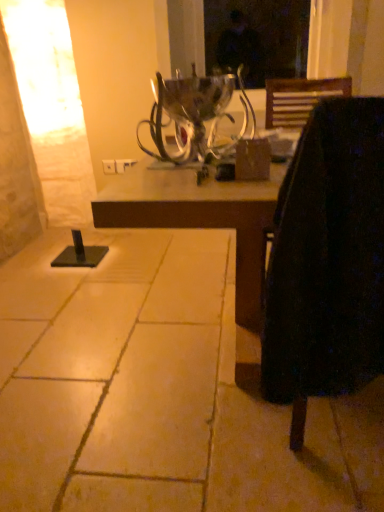
Question: From the image's perspective, is black fabric chair at right on top of metallic silver candle holder at center?

Choices:
 (A) no
 (B) yes

Answer: (A)

Question: Is black fabric chair at right directly adjacent to metallic silver candle holder at center?

Choices:
 (A) no
 (B) yes

Answer: (A)

Question: From a real-world perspective, is black fabric chair at right below metallic silver candle holder at center?

Choices:
 (A) no
 (B) yes

Answer: (B)

Question: Is black fabric chair at right wider than metallic silver candle holder at center?

Choices:
 (A) yes
 (B) no

Answer: (A)

Question: Can you confirm if black fabric chair at right is thinner than metallic silver candle holder at center?

Choices:
 (A) no
 (B) yes

Answer: (A)

Question: In terms of width, does brown tile floor at lower left look wider or thinner when compared to black fabric chair at right?

Choices:
 (A) thin
 (B) wide

Answer: (B)

Question: In the image, is brown tile floor at lower left on the left side or the right side of black fabric chair at right?

Choices:
 (A) right
 (B) left

Answer: (B)

Question: Relative to black fabric chair at right, is brown tile floor at lower left in front or behind?

Choices:
 (A) front
 (B) behind

Answer: (B)

Question: From a real-world perspective, relative to black fabric chair at right, is brown tile floor at lower left vertically above or below?

Choices:
 (A) above
 (B) below

Answer: (B)

Question: Would you say black fabric chair at right is inside or outside metallic silver candle holder at center?

Choices:
 (A) outside
 (B) inside

Answer: (A)

Question: From the image's perspective, is black fabric chair at right positioned above or below metallic silver candle holder at center?

Choices:
 (A) above
 (B) below

Answer: (B)

Question: Considering the relative positions of black fabric chair at right and metallic silver candle holder at center in the image provided, is black fabric chair at right to the left or to the right of metallic silver candle holder at center?

Choices:
 (A) right
 (B) left

Answer: (A)

Question: Looking at the image, does black fabric chair at right seem bigger or smaller compared to metallic silver candle holder at center?

Choices:
 (A) small
 (B) big

Answer: (B)

Question: In the image, is black fabric chair at right on the left side or the right side of brown tile floor at lower left?

Choices:
 (A) right
 (B) left

Answer: (A)

Question: Is black fabric chair at right inside the boundaries of brown tile floor at lower left, or outside?

Choices:
 (A) inside
 (B) outside

Answer: (B)